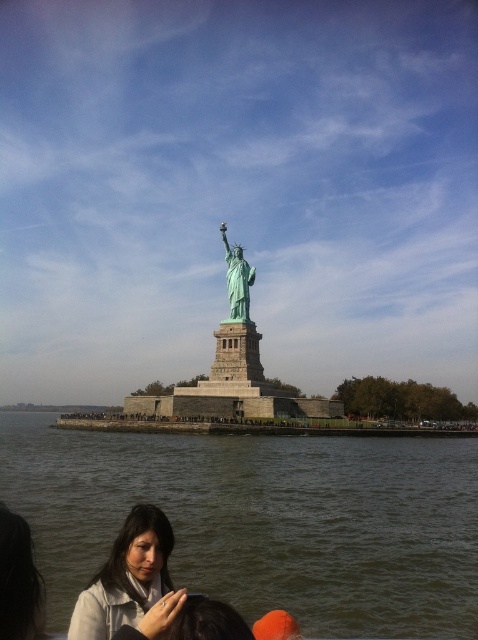
You are a tour guide standing at the base of the Statue of Liberty. You notice a tourist wearing a matte gray jacket at lower left and another tourist with dark brown hair at lower left. If you want to greet both tourists without moving from your current position, can you reach both of them with a single 8 meter long megaphone? Explain your reasoning.

The distance between the matte gray jacket at lower left and the dark brown hair at lower left is 7.02 meters. Since the megaphone is 8 meters long, which is longer than the distance between them, you can indeed reach both tourists with a single 8 meter long megaphone.

You are standing at the center of the image and want to walk towards the green stone water at lower center. Which direction should you move?

The green stone water at lower center is located at point 0.814 on the x axis and 0.550 on the y axis. Since you are at the center of the image, you should move towards the right and slightly downward to reach the green stone water at lower center.